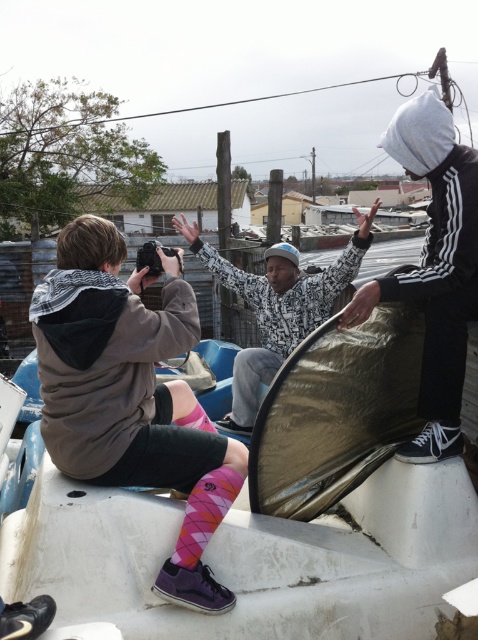
Question: Which object appears farthest from the camera in this image?

Choices:
 (A) pink argyle socks at lower center
 (B) pink diamond-patterned sock at lower center
 (C) white textured jacket at center

Answer: (C)

Question: Which object is farther from the camera taking this photo?

Choices:
 (A) white hoodie at upper right
 (B) pink argyle socks at lower left
 (C) white textured jacket at center

Answer: (C)

Question: Is white hoodie at upper right above white textured jacket at center?

Choices:
 (A) yes
 (B) no

Answer: (B)

Question: Does white textured jacket at center have a smaller size compared to pink argyle socks at lower center?

Choices:
 (A) yes
 (B) no

Answer: (B)

Question: Is white hoodie at upper right closer to camera compared to pink argyle socks at lower center?

Choices:
 (A) yes
 (B) no

Answer: (A)

Question: Which point appears closest to the camera in this image?

Choices:
 (A) (336, 259)
 (B) (193, 412)

Answer: (B)